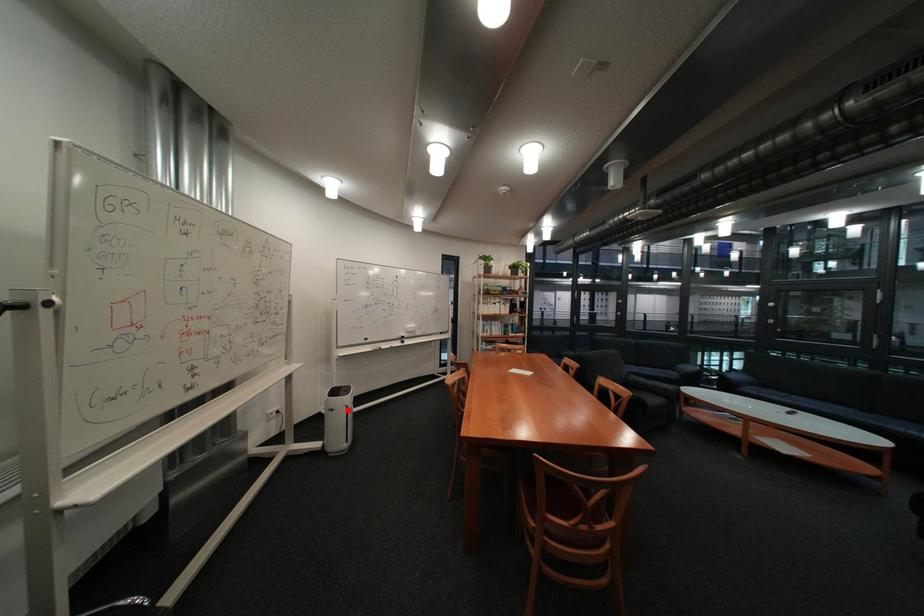
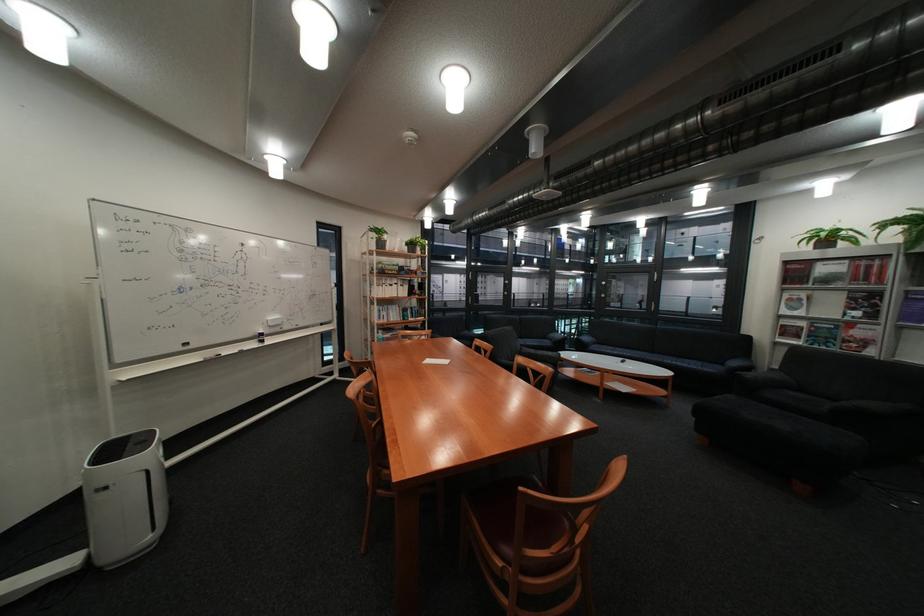
Question: A red point is marked in image1. In image2, is the corresponding 3D point closer to the camera or farther? Reply with the corresponding letter.

Choices:
 (A) The corresponding 3D point is closer.
 (B) The corresponding 3D point is farther.

Answer: (A)